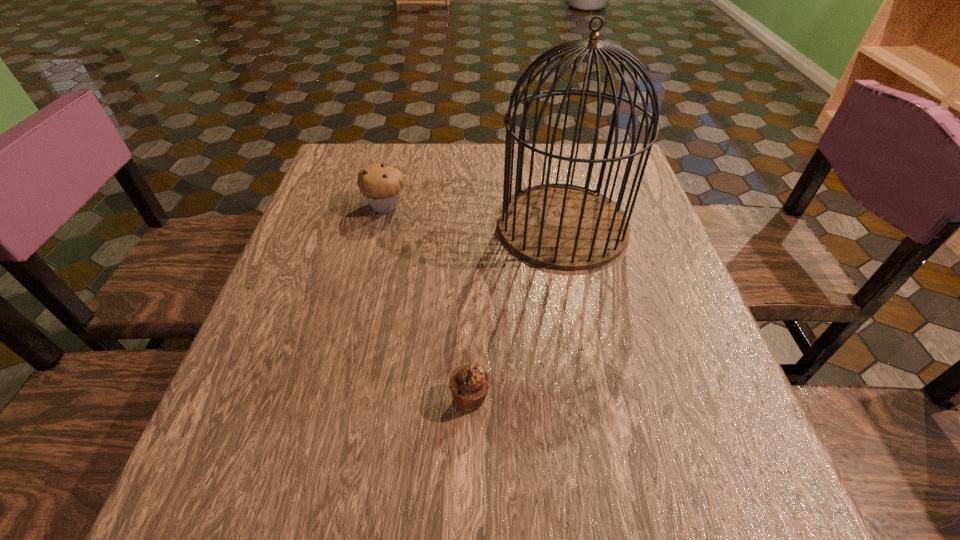
The height and width of the screenshot is (540, 960). I want to click on the tallest object, so click(x=567, y=227).

Identify the location of the rightmost object. (567, 227).

The width and height of the screenshot is (960, 540). In order to click on the leftmost object in this screenshot , I will do (381, 185).

Identify the location of the left muffin. (381, 185).

Identify the location of the nearer muffin. This screenshot has width=960, height=540. (469, 384).

The height and width of the screenshot is (540, 960). I want to click on the second object from left to right, so click(469, 384).

Identify the location of free space located at the door of the rightmost object. (430, 225).

Image resolution: width=960 pixels, height=540 pixels. Identify the location of vacant area located at the door of the rightmost object. (430, 225).

The height and width of the screenshot is (540, 960). What are the coordinates of `vacant region located 0.060m at the door of the rightmost object` in the screenshot? It's located at (472, 225).

You are a GUI agent. You are given a task and a screenshot of the screen. Output one action in this format:
    pyautogui.click(x=<x>, y=<y>)
    Task: Click on the vacant position located on the front of the left muffin
    This screenshot has height=540, width=960.
    Given the screenshot: What is the action you would take?
    pyautogui.click(x=370, y=269)